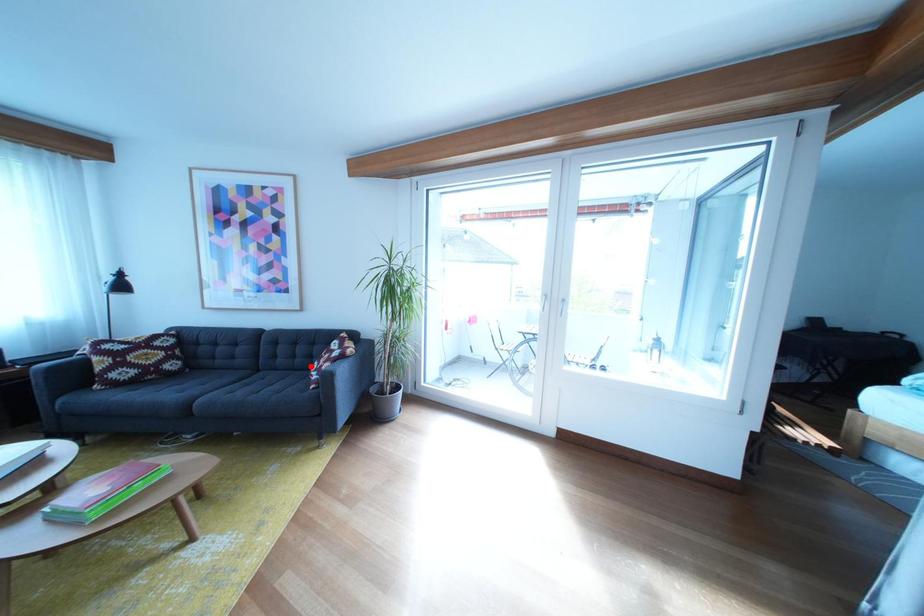
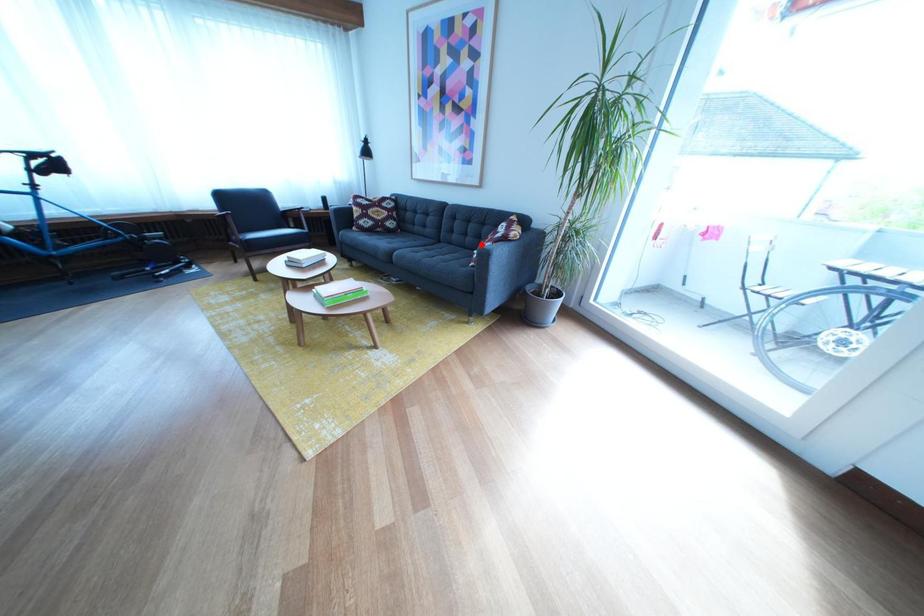
I am providing you with two images of the same scene from different viewpoints. A red point is marked on the first image and another point is marked on the second image. Is the marked point in image1 the same physical position as the marked point in image2?

Yes